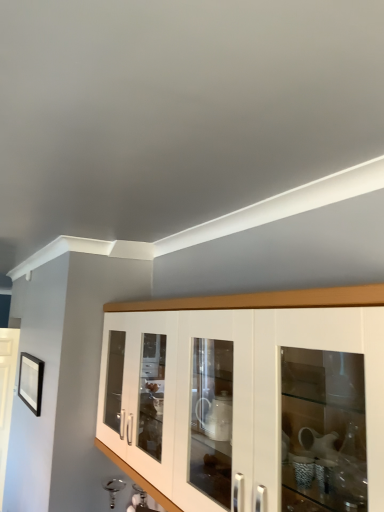
The width and height of the screenshot is (384, 512). What do you see at coordinates (31, 381) in the screenshot?
I see `black matte picture frame at upper left` at bounding box center [31, 381].

What is the approximate width of black matte picture frame at upper left?

The width of black matte picture frame at upper left is 1.94 inches.

Locate an element on the screen. black matte picture frame at upper left is located at coordinates (31, 381).

Measure the distance between black matte picture frame at upper left and camera.

black matte picture frame at upper left and camera are 9.14 feet apart.

At what (x,y) coordinates should I click in order to perform the action: click on white glossy cabinet at center. Please return your answer as a coordinate pair (x, y). This screenshot has height=512, width=384. Looking at the image, I should click on (263, 300).

What do you see at coordinates (263, 300) in the screenshot?
I see `white glossy cabinet at center` at bounding box center [263, 300].

Image resolution: width=384 pixels, height=512 pixels. What are the coordinates of `black matte picture frame at upper left` in the screenshot? It's located at (31, 381).

Does white glossy cabinet at center appear on the left side of black matte picture frame at upper left?

No.

Which object is further away from the camera taking this photo, white glossy cabinet at center or black matte picture frame at upper left?

Positioned behind is black matte picture frame at upper left.

Does point (289, 306) come in front of point (19, 394)?

Yes, it is.

From the image's perspective, who appears lower, white glossy cabinet at center or black matte picture frame at upper left?

black matte picture frame at upper left appears lower in the image.

From a real-world perspective, which is physically above, white glossy cabinet at center or black matte picture frame at upper left?

In real-world perspective, white glossy cabinet at center is above.

Does white glossy cabinet at center have a greater width compared to black matte picture frame at upper left?

Indeed, white glossy cabinet at center has a greater width compared to black matte picture frame at upper left.

Considering the sizes of white glossy cabinet at center and black matte picture frame at upper left in the image, is white glossy cabinet at center taller or shorter than black matte picture frame at upper left?

In the image, white glossy cabinet at center appears to be taller than black matte picture frame at upper left.

Considering the sizes of objects white glossy cabinet at center and black matte picture frame at upper left in the image provided, who is bigger, white glossy cabinet at center or black matte picture frame at upper left?

Bigger between the two is white glossy cabinet at center.

Consider the image. Would you say white glossy cabinet at center is inside or outside black matte picture frame at upper left?

white glossy cabinet at center is outside black matte picture frame at upper left.

Is white glossy cabinet at center in contact with black matte picture frame at upper left?

white glossy cabinet at center and black matte picture frame at upper left are not in contact.

Is white glossy cabinet at center oriented towards black matte picture frame at upper left?

No, white glossy cabinet at center is not aimed at black matte picture frame at upper left.

Where is `cabinetry on the right of black matte picture frame at upper left`? This screenshot has height=512, width=384. cabinetry on the right of black matte picture frame at upper left is located at coordinates [x=263, y=300].

Visually, is black matte picture frame at upper left positioned to the left or to the right of white glossy cabinet at center?

From the image, it's evident that black matte picture frame at upper left is to the left of white glossy cabinet at center.

Is the depth of black matte picture frame at upper left less than that of white glossy cabinet at center?

That is False.

Does point (27, 360) come behind point (184, 301)?

Yes, it is.

From the image's perspective, which one is positioned higher, black matte picture frame at upper left or white glossy cabinet at center?

white glossy cabinet at center, from the image's perspective.

From a real-world perspective, is black matte picture frame at upper left located beneath white glossy cabinet at center?

Yes, from a real-world perspective, black matte picture frame at upper left is below white glossy cabinet at center.

From the picture: Can you confirm if black matte picture frame at upper left is wider than white glossy cabinet at center?

No, black matte picture frame at upper left is not wider than white glossy cabinet at center.

Considering the sizes of objects black matte picture frame at upper left and white glossy cabinet at center in the image provided, who is taller, black matte picture frame at upper left or white glossy cabinet at center?

Standing taller between the two is white glossy cabinet at center.

Considering the sizes of objects black matte picture frame at upper left and white glossy cabinet at center in the image provided, who is bigger, black matte picture frame at upper left or white glossy cabinet at center?

white glossy cabinet at center.

Is black matte picture frame at upper left spatially inside white glossy cabinet at center, or outside of it?

black matte picture frame at upper left is not enclosed by white glossy cabinet at center.

Is black matte picture frame at upper left not near white glossy cabinet at center?

Indeed, black matte picture frame at upper left is not near white glossy cabinet at center.

Could you tell me if black matte picture frame at upper left is facing white glossy cabinet at center?

No, black matte picture frame at upper left does not turn towards white glossy cabinet at center.

Can you tell me how much black matte picture frame at upper left and white glossy cabinet at center differ in facing direction?

The facing directions of black matte picture frame at upper left and white glossy cabinet at center are 0.196 degrees apart.

What are the coordinates of `picture frame lying below the white glossy cabinet at center (from the image's perspective)` in the screenshot? It's located at (31, 381).

The image size is (384, 512). Find the location of `cabinetry lying on the right of black matte picture frame at upper left`. cabinetry lying on the right of black matte picture frame at upper left is located at coordinates click(x=263, y=300).

There is a black matte picture frame at upper left. Identify the location of cabinetry above it (from a real-world perspective). (263, 300).